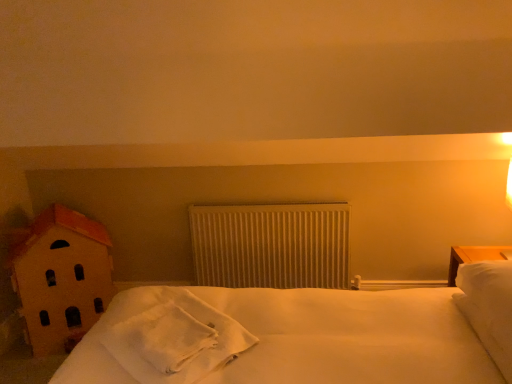
What do you see at coordinates (489, 308) in the screenshot? I see `white soft pillow at right` at bounding box center [489, 308].

The width and height of the screenshot is (512, 384). Describe the element at coordinates (175, 338) in the screenshot. I see `white soft towel at center` at that location.

At what (x,y) coordinates should I click in order to perform the action: click on white soft pillow at right. Please return your answer as a coordinate pair (x, y). Looking at the image, I should click on (489, 308).

Is wooden house at left positioned beyond the bounds of white soft towel at center?

Indeed, wooden house at left is completely outside white soft towel at center.

Is wooden house at left in contact with white soft towel at center?

No, wooden house at left is not making contact with white soft towel at center.

Is wooden house at left taller than white soft towel at center?

Yes, wooden house at left is taller than white soft towel at center.

Does wooden house at left come in front of white soft towel at center?

No.

Is white soft towel at center looking in the opposite direction of wooden house at left?

white soft towel at center does not have its back to wooden house at left.

From a real-world perspective, is white soft towel at center positioned above or below wooden house at left?

From a real-world perspective, white soft towel at center is physically above wooden house at left.

Is white soft towel at center behind wooden house at left?

No.

Visually, is white soft pillow at right positioned to the left or to the right of white textured radiator at center?

From the image, it's evident that white soft pillow at right is to the right of white textured radiator at center.

Based on the photo, considering the relative sizes of white soft pillow at right and white textured radiator at center in the image provided, is white soft pillow at right shorter than white textured radiator at center?

Yes.

Between white soft pillow at right and white textured radiator at center, which one has larger size?

white soft pillow at right is bigger.

Find the location of a particular element. The width and height of the screenshot is (512, 384). pillow lying below the white textured radiator at center (from the image's perspective) is located at coordinates (489, 308).

Consider the image. Is white soft towel at center positioned with its back to white soft pillow at right?

No.

Is the depth of white soft towel at center less than that of white soft pillow at right?

No, the depth of white soft towel at center is greater than that of white soft pillow at right.

Find the location of `pillow lying on the right of white soft towel at center`. pillow lying on the right of white soft towel at center is located at coordinates (489, 308).

From a real-world perspective, is white soft towel at center positioned under white soft pillow at right based on gravity?

Correct, in the physical world, white soft towel at center is lower than white soft pillow at right.

Who is shorter, wooden house at left or white textured radiator at center?

Standing shorter between the two is white textured radiator at center.

Is point (95, 304) positioned behind point (334, 275)?

No, (95, 304) is closer to viewer.

Is there a large distance between wooden house at left and white textured radiator at center?

No, wooden house at left is not far away from white textured radiator at center.

Which object is closer to the camera taking this photo, white soft pillow at right or wooden house at left?

white soft pillow at right is more forward.

Is white soft pillow at right far away from wooden house at left?

Yes, white soft pillow at right is far from wooden house at left.

From the image's perspective, which one is positioned lower, white soft pillow at right or wooden house at left?

wooden house at left is shown below in the image.

Considering the relative positions of white textured radiator at center and white soft pillow at right in the image provided, is white textured radiator at center to the left of white soft pillow at right from the viewer's perspective?

Indeed, white textured radiator at center is positioned on the left side of white soft pillow at right.

Measure the distance between white textured radiator at center and white soft pillow at right.

3.69 feet.

Is white textured radiator at center in front of or behind white soft pillow at right in the image?

white textured radiator at center is behind white soft pillow at right.

Is white textured radiator at center directly adjacent to white soft pillow at right?

No, white textured radiator at center is not in contact with white soft pillow at right.

The image size is (512, 384). I want to click on toy that is above the white soft towel at center (from the image's perspective), so click(x=61, y=277).

Image resolution: width=512 pixels, height=384 pixels. In the image, there is a white soft towel at center. Find the location of `toy below it (from a real-world perspective)`. toy below it (from a real-world perspective) is located at coordinates (61, 277).

Considering their positions, is wooden house at left positioned closer to white soft towel at center than white soft pillow at right?

Among the two, wooden house at left is located nearer to white soft towel at center.

When comparing their distances from white soft towel at center, does wooden house at left or white textured radiator at center seem further?

Based on the image, white textured radiator at center appears to be further to white soft towel at center.

Based on their spatial positions, is white soft towel at center or white textured radiator at center further from white soft pillow at right?

white textured radiator at center is positioned further to the anchor white soft pillow at right.

Estimate the real-world distances between objects in this image. Which object is further from white soft pillow at right, white textured radiator at center or wooden house at left?

wooden house at left is further to white soft pillow at right.

Estimate the real-world distances between objects in this image. Which object is closer to white soft pillow at right, white soft towel at center or wooden house at left?

white soft towel at center is closer to white soft pillow at right.

Looking at the image, which one is located closer to white textured radiator at center, white soft pillow at right or wooden house at left?

Based on the image, wooden house at left appears to be nearer to white textured radiator at center.

In the scene shown: Based on their spatial positions, is white textured radiator at center or white soft pillow at right further from white soft towel at center?

white soft pillow at right lies further to white soft towel at center than the other object.

Looking at the image, which one is located further to white textured radiator at center, wooden house at left or white soft pillow at right?

white soft pillow at right lies further to white textured radiator at center than the other object.

You are a GUI agent. You are given a task and a screenshot of the screen. Output one action in this format:
    pyautogui.click(x=<x>, y=<y>)
    Task: Click on the radiator between wooden house at left and white soft pillow at right in the horizontal direction
    The image size is (512, 384).
    Given the screenshot: What is the action you would take?
    point(271,245)

The width and height of the screenshot is (512, 384). Identify the location of material between white soft pillow at right and white textured radiator at center in the front-back direction. (175, 338).

Locate an element on the screen. This screenshot has height=384, width=512. material situated between wooden house at left and white soft pillow at right from left to right is located at coordinates coord(175,338).

You are a GUI agent. You are given a task and a screenshot of the screen. Output one action in this format:
    pyautogui.click(x=<x>, y=<y>)
    Task: Click on the material between wooden house at left and white textured radiator at center from left to right
    The image size is (512, 384).
    Given the screenshot: What is the action you would take?
    pyautogui.click(x=175, y=338)